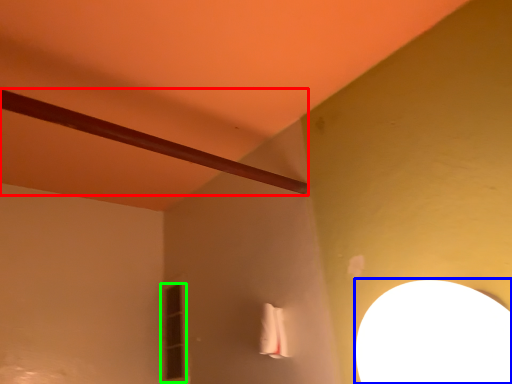
Question: Based on their relative distances, which object is farther from beam (highlighted by a red box)? Choose from lamp (highlighted by a blue box) and window (highlighted by a green box).

Choices:
 (A) lamp
 (B) window

Answer: (B)